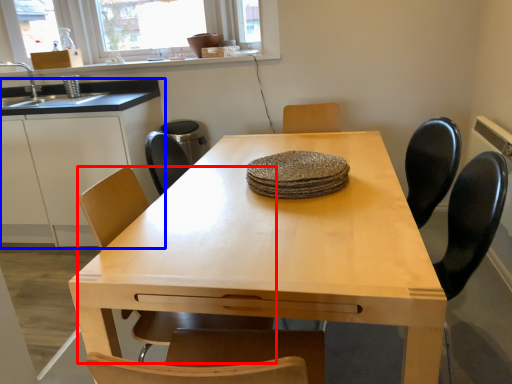
Question: Which object appears farthest to the camera in this image, chair (highlighted by a red box) or cabinetry (highlighted by a blue box)?

Choices:
 (A) chair
 (B) cabinetry

Answer: (B)